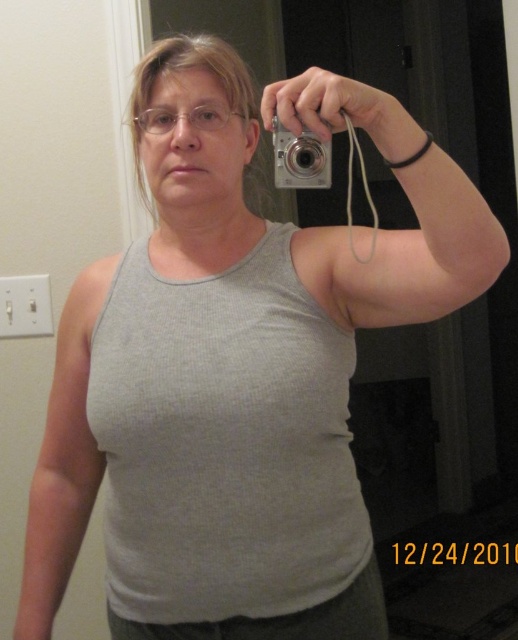
Question: Among these points, which one is farthest from the camera?

Choices:
 (A) (218, 541)
 (B) (319, 170)
 (C) (198, 129)

Answer: (C)

Question: Which point is farther from the camera taking this photo?

Choices:
 (A) (280, 164)
 (B) (165, 118)

Answer: (B)

Question: Does silver metallic camera at upper center have a lesser width compared to clear plastic glasses at center?

Choices:
 (A) no
 (B) yes

Answer: (B)

Question: Which point is closer to the camera?

Choices:
 (A) silver metallic camera at upper center
 (B) clear plastic glasses at center
 (C) gray ribbed tank top at center

Answer: (A)

Question: Can you confirm if silver metallic camera at upper center is positioned to the right of clear plastic glasses at center?

Choices:
 (A) no
 (B) yes

Answer: (B)

Question: Is silver metallic camera at upper center bigger than clear plastic glasses at center?

Choices:
 (A) no
 (B) yes

Answer: (B)